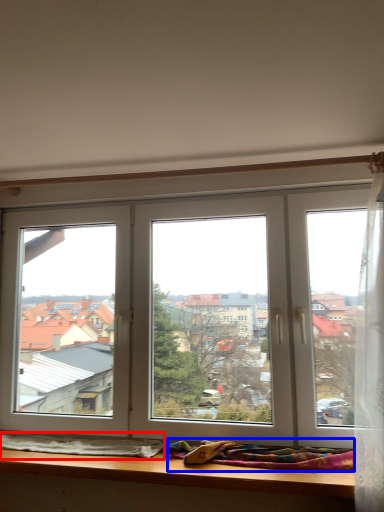
Question: Which of the following is the closest to the observer, blanket (highlighted by a red box) or blanket (highlighted by a blue box)?

Choices:
 (A) blanket
 (B) blanket

Answer: (B)